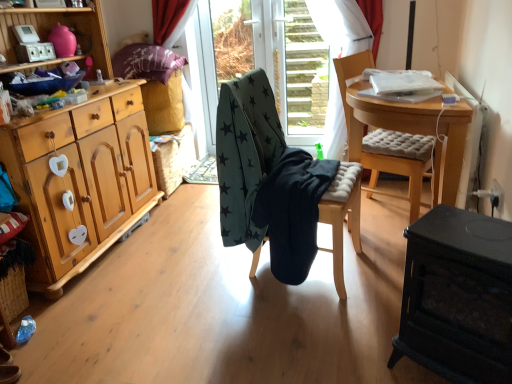
Identify the location of vacant space to the left of dark green fabric stool at center. This screenshot has width=512, height=384. (196, 274).